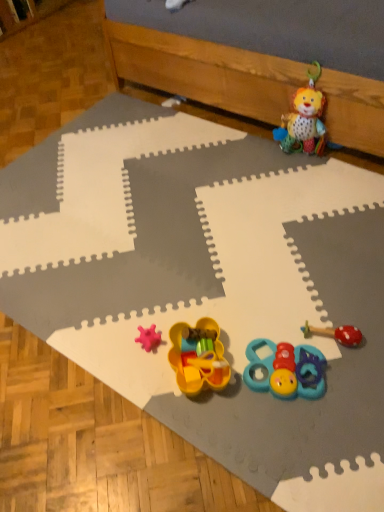
The image size is (384, 512). What are the coordinates of `vacant space behind teal rubber teething toy at lower center, placed as the 1th toy when sorted from bottom to top` in the screenshot? It's located at (272, 312).